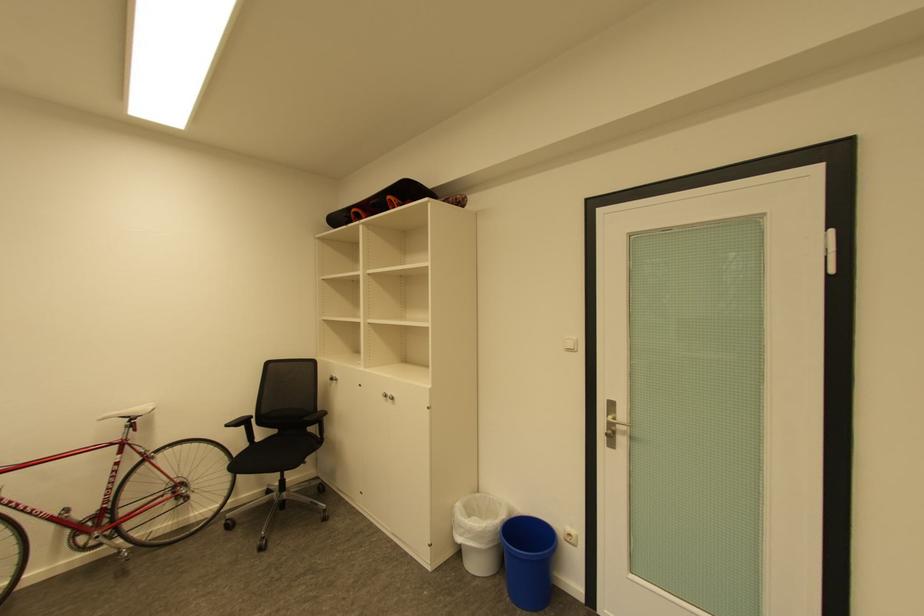
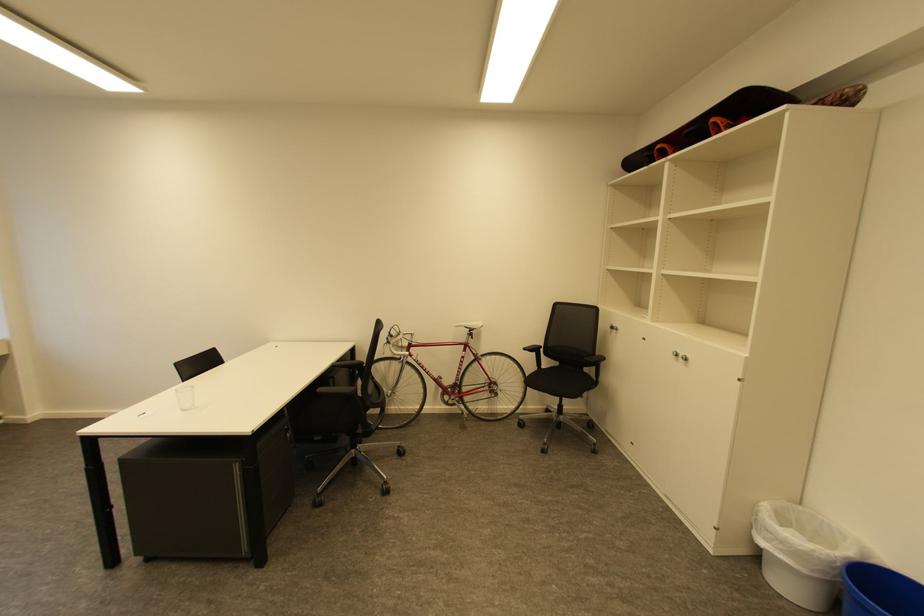
The point at [395,198] is marked in the first image. Where is the corresponding point in the second image?

(719, 120)